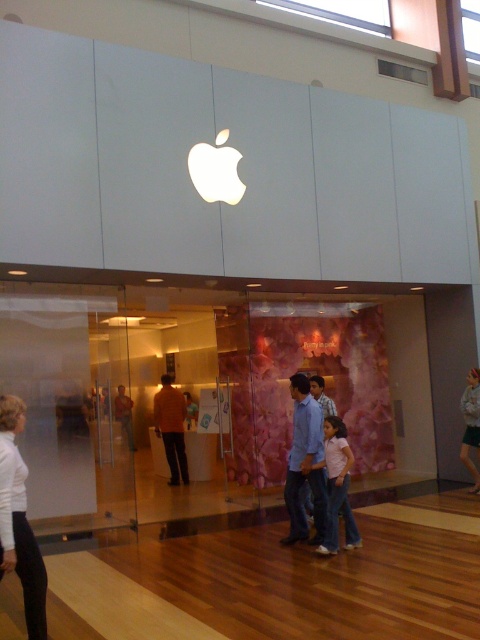
Question: Is pink cotton shirt at center closer to camera compared to orange fabric shirt at center?

Choices:
 (A) no
 (B) yes

Answer: (B)

Question: Estimate the real-world distances between objects in this image. Which object is farther from the orange shirt at center?

Choices:
 (A) orange fabric shirt at center
 (B) white matte pants at lower left

Answer: (B)

Question: Which of these objects is positioned farthest from the white matte pants at lower left?

Choices:
 (A) orange shirt at center
 (B) pink cotton shirt at center
 (C) orange fabric shirt at center
 (D) light blue jeans at center

Answer: (C)

Question: Observing the image, what is the correct spatial positioning of blue jeans at center in reference to light blue jeans at center?

Choices:
 (A) below
 (B) above

Answer: (B)

Question: Which is farther from the light blue jeans at center?

Choices:
 (A) white matte pants at lower left
 (B) orange shirt at center

Answer: (A)

Question: Is orange fabric shirt at center further to the viewer compared to orange shirt at center?

Choices:
 (A) no
 (B) yes

Answer: (B)